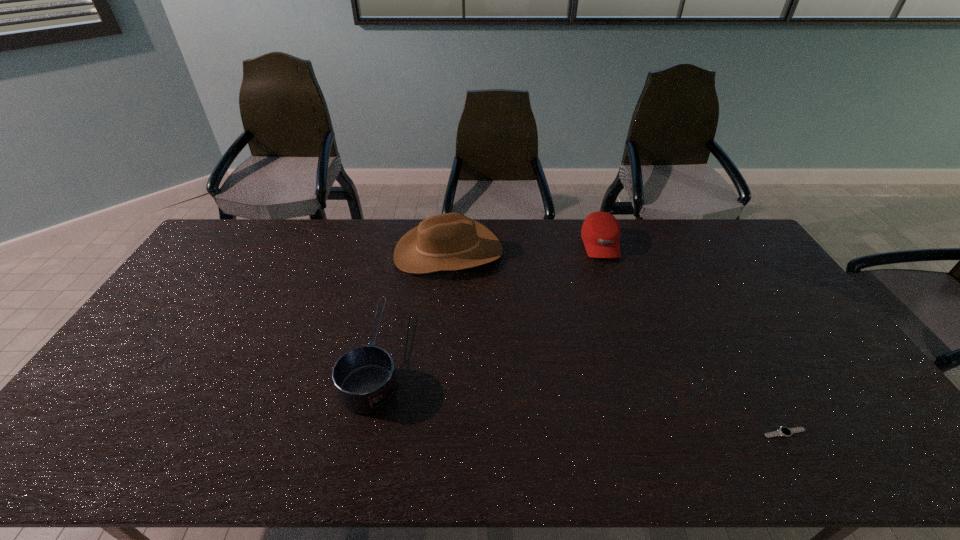
Find the location of a particular element. This screenshot has height=540, width=960. free spot located on the left of the watch is located at coordinates (676, 433).

Where is `cowboy hat situated at the far edge`? The width and height of the screenshot is (960, 540). cowboy hat situated at the far edge is located at coordinates (451, 241).

I want to click on cap that is positioned at the far edge, so click(x=600, y=232).

You are a GUI agent. You are given a task and a screenshot of the screen. Output one action in this format:
    pyautogui.click(x=<x>, y=<y>)
    Task: Click on the object situated at the near edge
    Image resolution: width=960 pixels, height=540 pixels.
    Given the screenshot: What is the action you would take?
    pyautogui.click(x=784, y=431)

Identify the location of free space at the far edge of the desktop. This screenshot has height=540, width=960. (632, 244).

This screenshot has width=960, height=540. In order to click on free space at the near edge of the desktop in this screenshot , I will do `click(664, 434)`.

Image resolution: width=960 pixels, height=540 pixels. In order to click on vacant space at the left edge of the desktop in this screenshot , I will do `click(191, 306)`.

The width and height of the screenshot is (960, 540). I want to click on vacant space at the far left corner of the desktop, so click(x=247, y=246).

At what (x,y) coordinates should I click in order to perform the action: click on free spot at the near left corner of the desktop. Please return your answer as a coordinate pair (x, y). The image size is (960, 540). Looking at the image, I should click on (52, 457).

The height and width of the screenshot is (540, 960). Find the location of `free space at the near right corner of the desktop`. free space at the near right corner of the desktop is located at coordinates (865, 453).